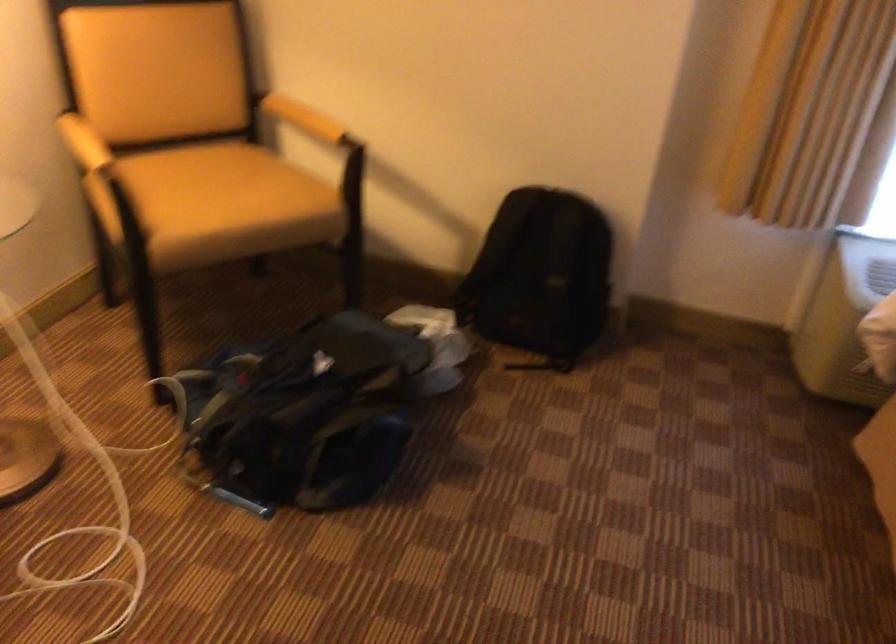
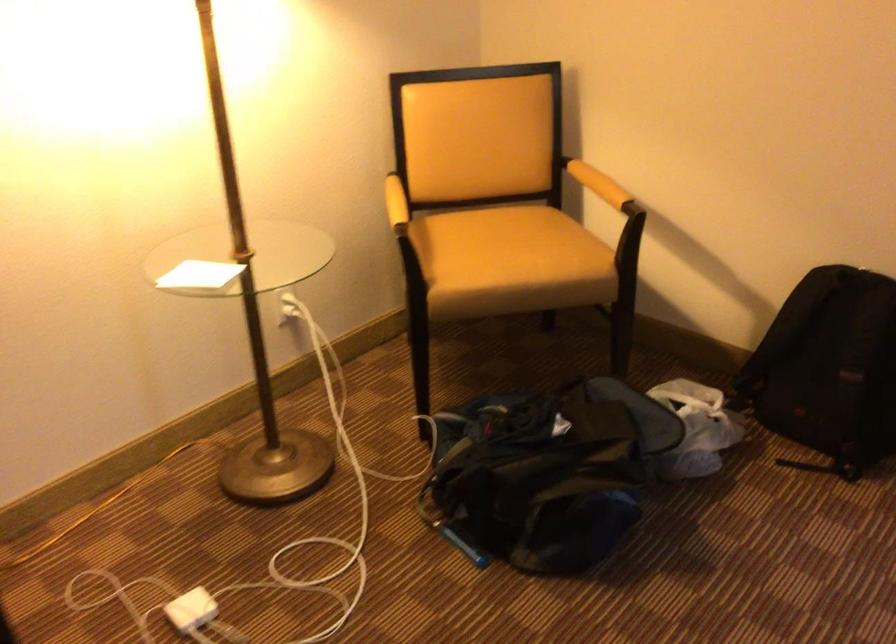
The point at (238, 201) is marked in the first image. Where is the corresponding point in the second image?

(510, 261)